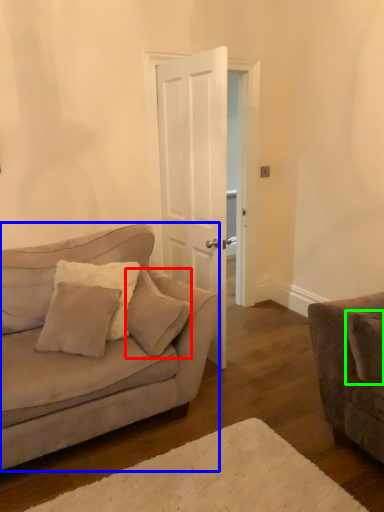
Question: Estimate the real-world distances between objects in this image. Which object is closer to pillow (highlighted by a red box), studio couch (highlighted by a blue box) or pillow (highlighted by a green box)?

Choices:
 (A) studio couch
 (B) pillow

Answer: (A)